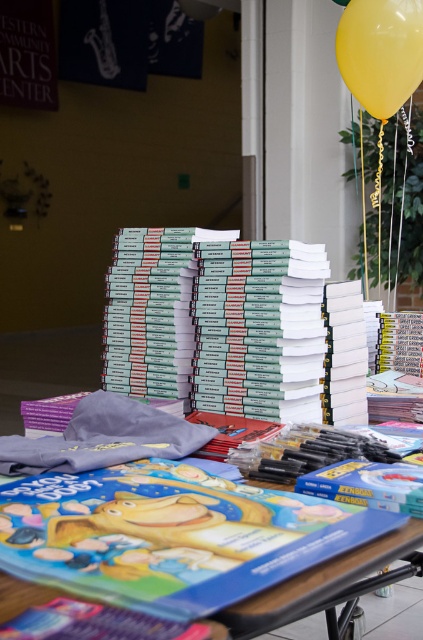
You have a green matte book at center and a matte plastic table at center. Which one is wider?

The green matte book at center is wider than the matte plastic table at center.

You are at the Western Community Arts Center and see a table with various items. There is a green matte book at center. Where is the green matte book located relative to the point marked at coordinates (231,326)?

The point marked at coordinates (231,326) indicates the location of the green matte book at center, so it is exactly at that point.

You are organizing a book display at the Western Community Arts Center. You have a green matte book at center that needs to be placed in a specific location. According to the coordinates provided, where should you position this book on the table?

The green matte book at center should be placed at the coordinates point (231, 326).